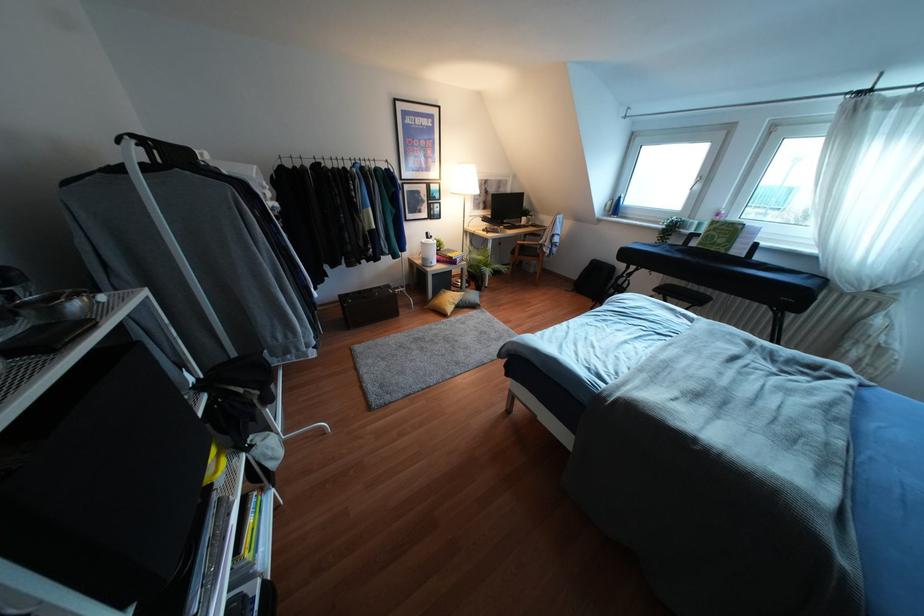
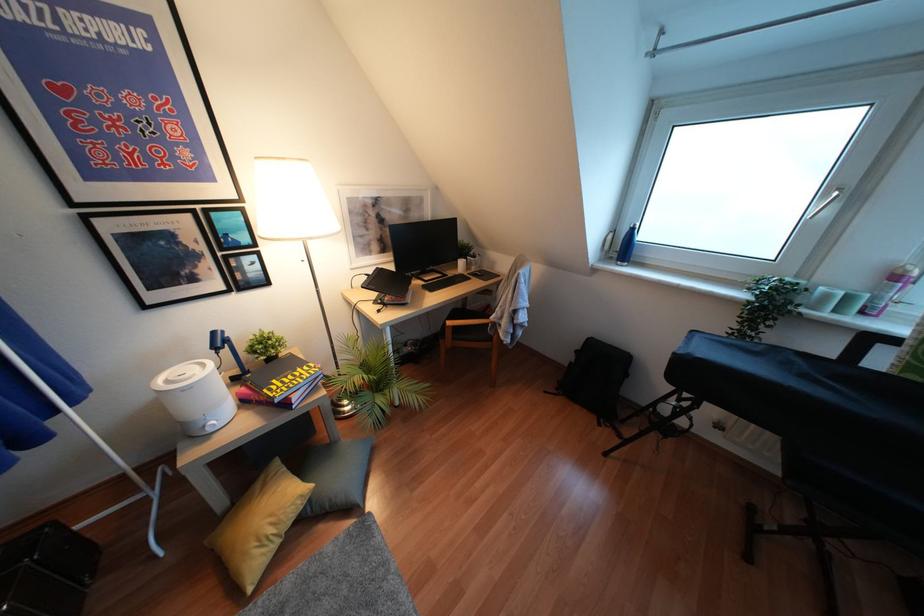
Locate, in the second image, the point that corresponds to [614,208] in the first image.

(623, 246)